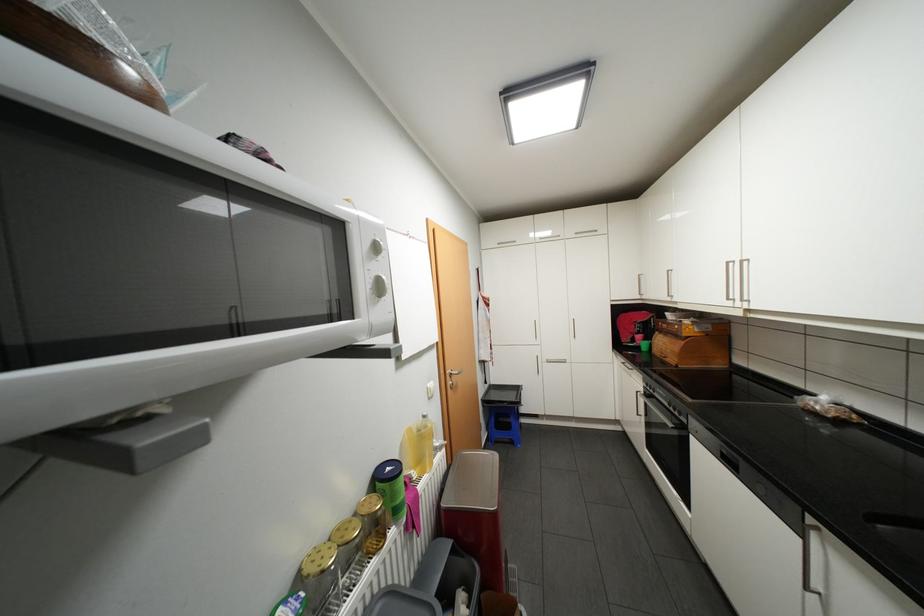
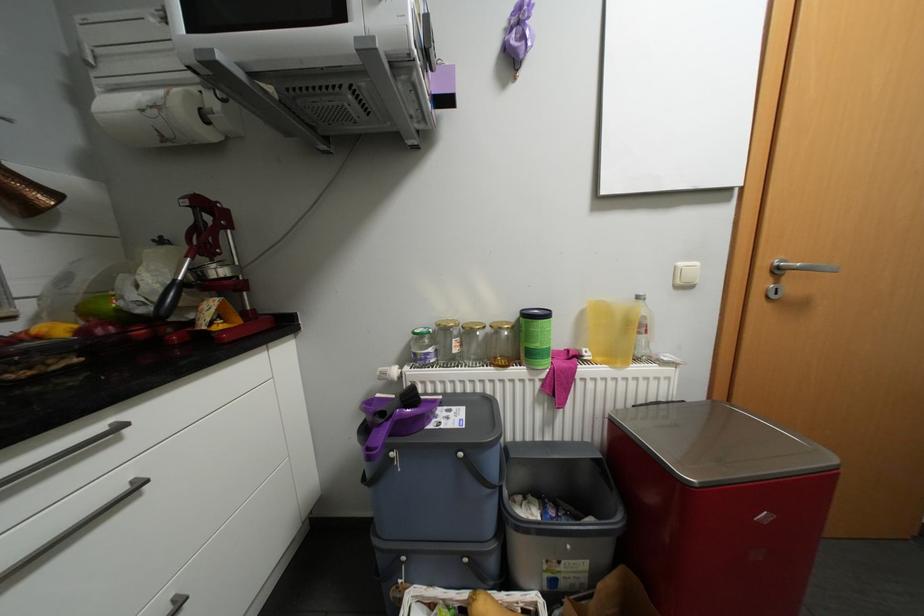
Question: The images are taken continuously from a first-person perspective. In which direction is your viewpoint rotating?

Choices:
 (A) Left
 (B) Right
 (C) Up
 (D) Down

Answer: (A)